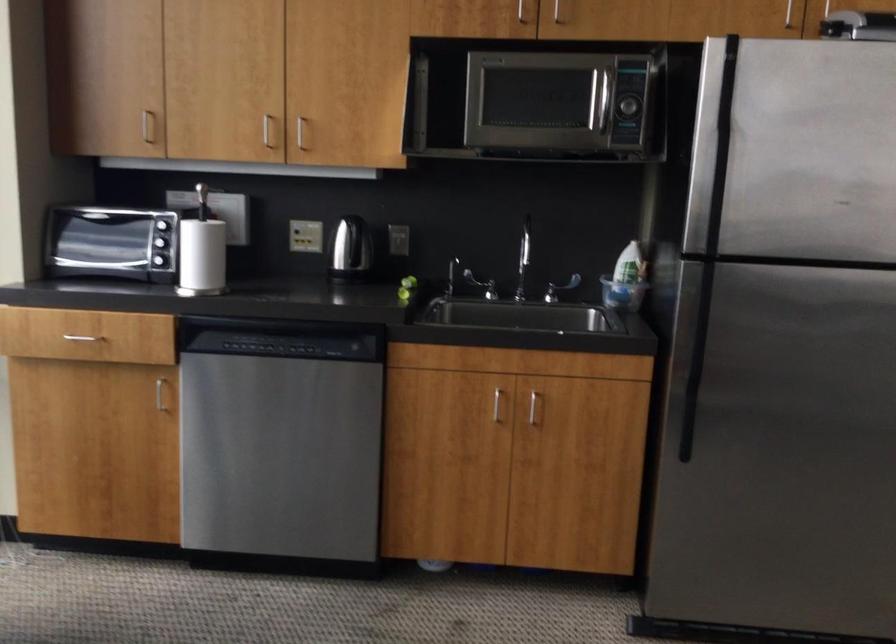
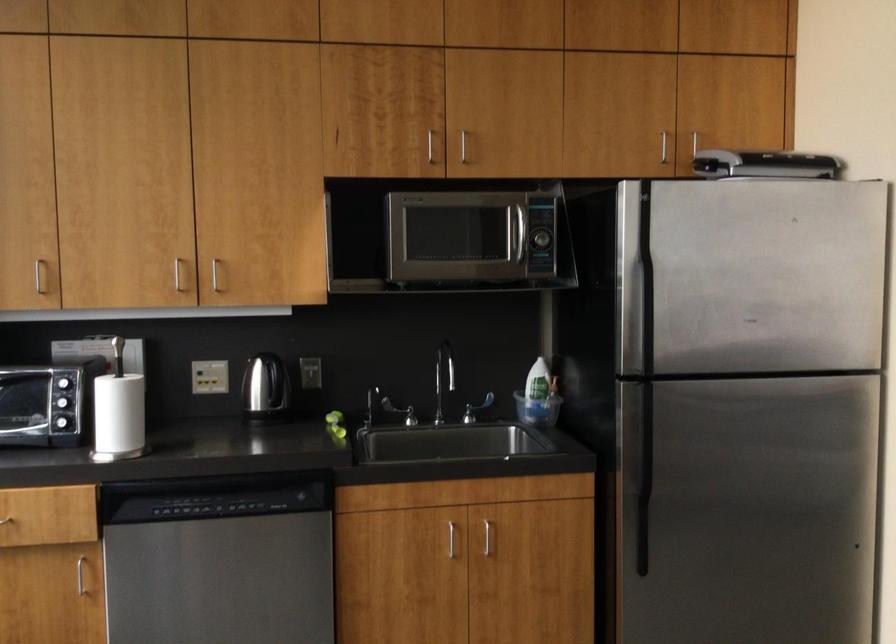
Locate, in the second image, the point that corresponds to point 626,106 in the first image.

(540, 239)